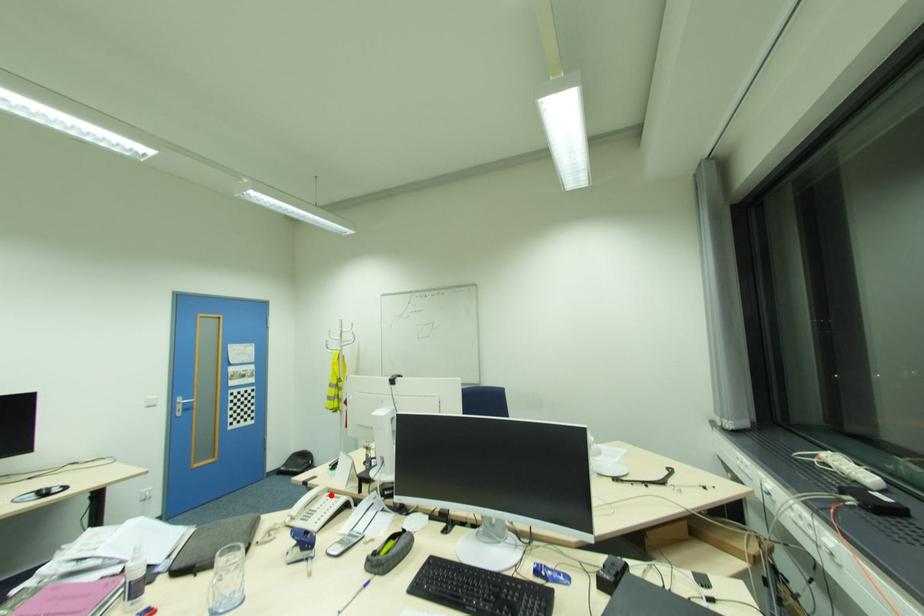
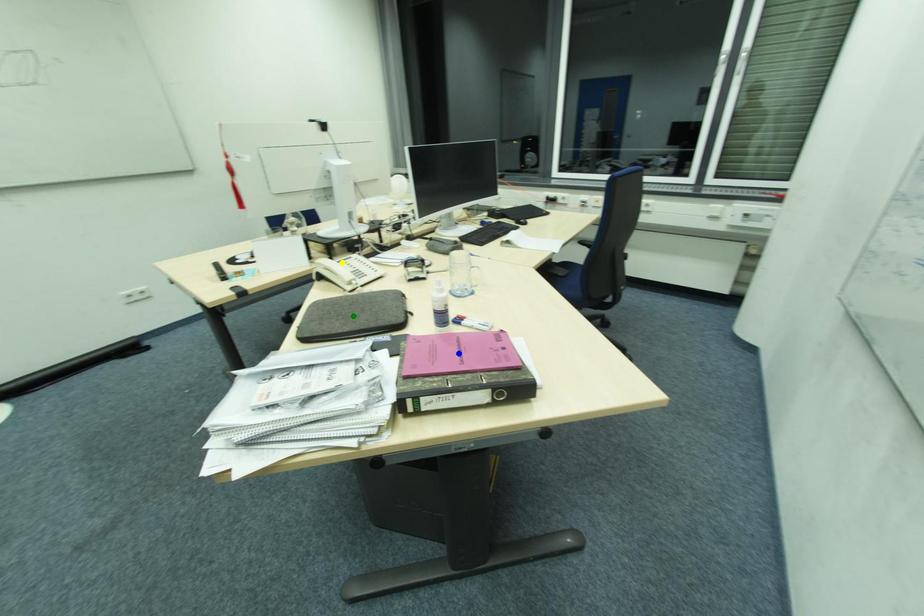
Question: I am providing you with two images of the same scene from different viewpoints. A red point is marked on the first image. You are given multiple points on the second image. Which mark in image 2 goes with the point in image 1?

Choices:
 (A) green point
 (B) yellow point
 (C) blue point

Answer: (B)